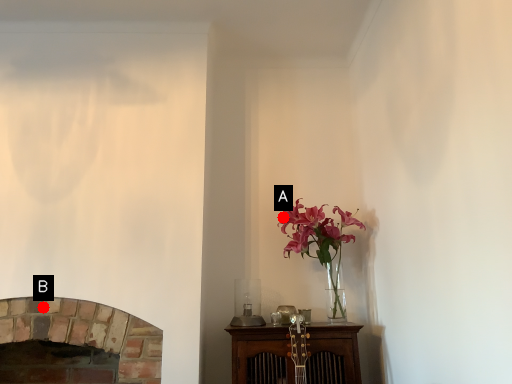
Question: Two points are circled on the image, labeled by A and B beside each circle. Which of the following is the farthest from the observer?

Choices:
 (A) A is further
 (B) B is further

Answer: (A)